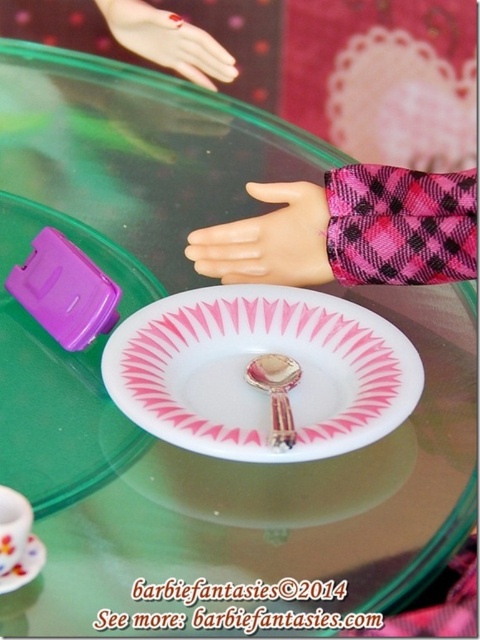
This screenshot has width=480, height=640. In order to click on white glossy plate at lower center in this screenshot , I will do `click(60, 374)`.

Who is more forward, (7, 220) or (108, 26)?

Positioned in front is point (7, 220).

Where is `white glossy plate at lower center`? This screenshot has height=640, width=480. white glossy plate at lower center is located at coordinates (60, 374).

Who is more distant from viewer, (9, 301) or (20, 513)?

The point (9, 301) is behind.

In the scene shown: Who is more forward, (x=3, y=460) or (x=1, y=561)?

Point (x=1, y=561) is more forward.

At what (x,y) coordinates should I click in order to perform the action: click on white glossy plate at lower center. Please return your answer as a coordinate pair (x, y). Looking at the image, I should click on (60, 374).

Who is positioned more to the left, white glossy paper plate at center or pink matte hand at upper center?

pink matte hand at upper center is more to the left.

Who is more forward, (x=184, y=400) or (x=134, y=12)?

Point (x=184, y=400)

This screenshot has height=640, width=480. What are the coordinates of `white glossy paper plate at center` in the screenshot? It's located at (248, 364).

Identify the location of white glossy paper plate at center. The height and width of the screenshot is (640, 480). (248, 364).